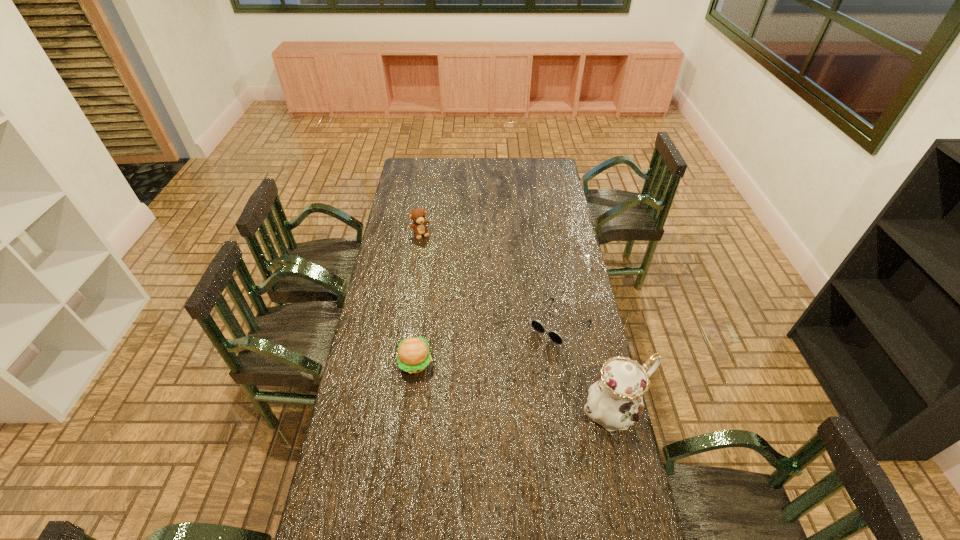
Locate an element on the screen. vacant space that's between the third shortest object and the hamburger is located at coordinates (418, 298).

Locate an element on the screen. Image resolution: width=960 pixels, height=540 pixels. free area in between the hamburger and the third shortest object is located at coordinates (418, 298).

At what (x,y) coordinates should I click in order to perform the action: click on free spot between the sunglasses and the second shortest object. Please return your answer as a coordinate pair (x, y). Looking at the image, I should click on (488, 343).

In order to click on object that is the second nearest to the hamburger in this screenshot , I will do `click(615, 401)`.

The width and height of the screenshot is (960, 540). In order to click on object that stands as the closest to the sunglasses in this screenshot , I will do `click(615, 401)`.

You are a GUI agent. You are given a task and a screenshot of the screen. Output one action in this format:
    pyautogui.click(x=<x>, y=<y>)
    Task: Click on the free location that satisfies the following two spatial constraints: 1. on the front side of the teddy bear; 2. on the left side of the tallest object
    
    Given the screenshot: What is the action you would take?
    pyautogui.click(x=394, y=411)

Identify the location of vacant space that satisfies the following two spatial constraints: 1. on the front side of the chinaware; 2. on the left side of the third shortest object. (394, 411).